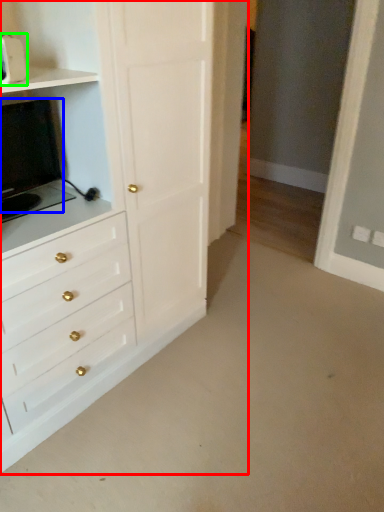
Question: Which object is positioned closest to chest of drawers (highlighted by a red box)? Select from appliance (highlighted by a blue box) and appliance (highlighted by a green box).

Choices:
 (A) appliance
 (B) appliance

Answer: (A)